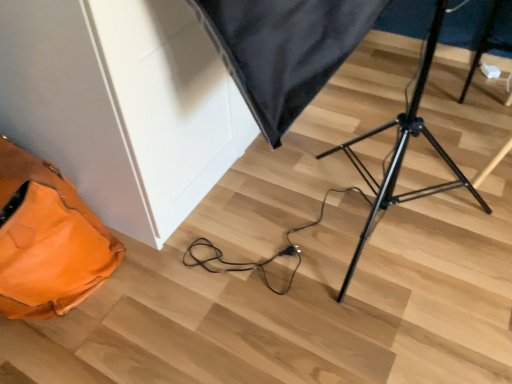
This screenshot has height=384, width=512. What do you see at coordinates (47, 239) in the screenshot? I see `orange leather bag at lower left` at bounding box center [47, 239].

I want to click on orange leather bag at lower left, so click(47, 239).

Find the location of a particular element. orange leather bag at lower left is located at coordinates (47, 239).